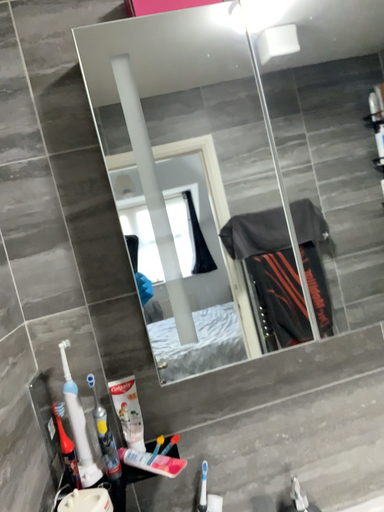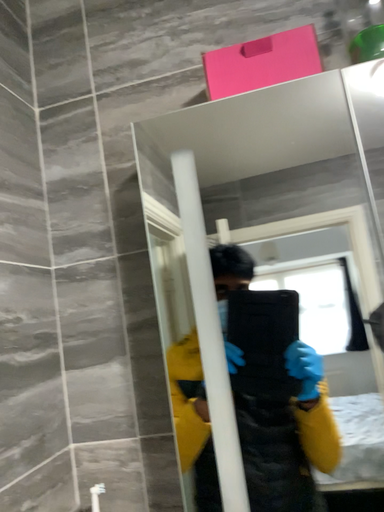
Question: How did the camera likely rotate when shooting the video?

Choices:
 (A) rotated downward
 (B) rotated upward

Answer: (B)